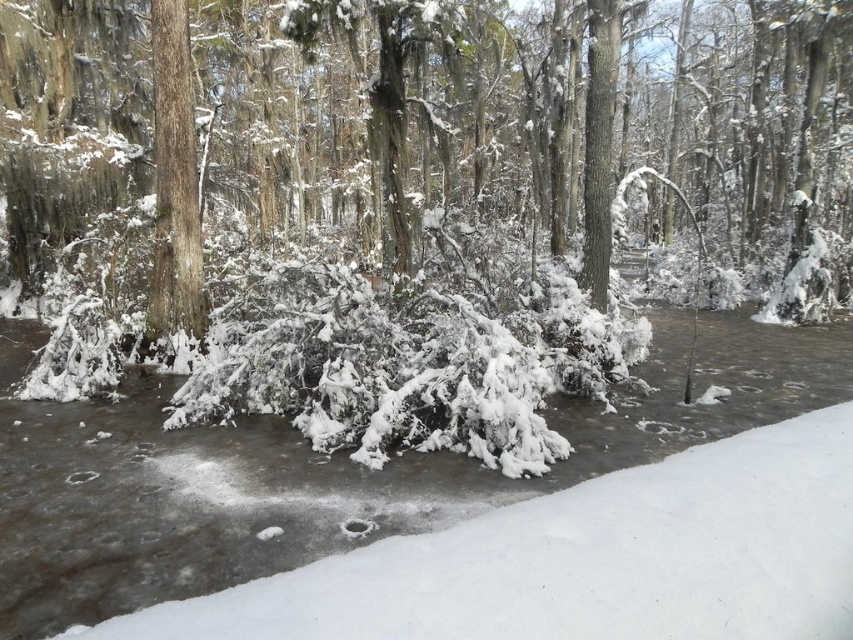
Can you confirm if white frosted stream at center is wider than smooth bark tree at center?

Indeed, white frosted stream at center has a greater width compared to smooth bark tree at center.

Who is more forward, (756, 404) or (166, 282)?

Positioned in front is point (756, 404).

The height and width of the screenshot is (640, 853). I want to click on white frosted stream at center, so click(x=322, y=470).